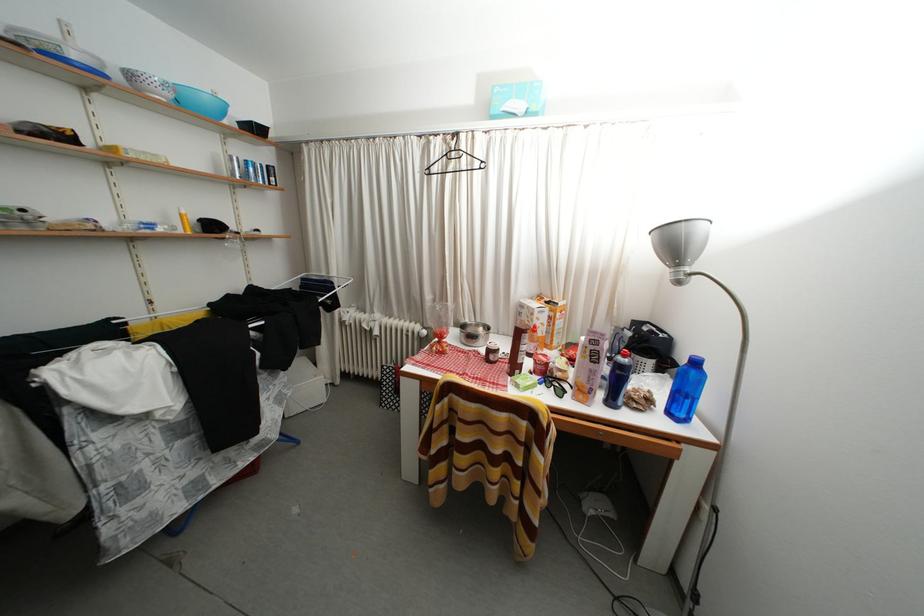
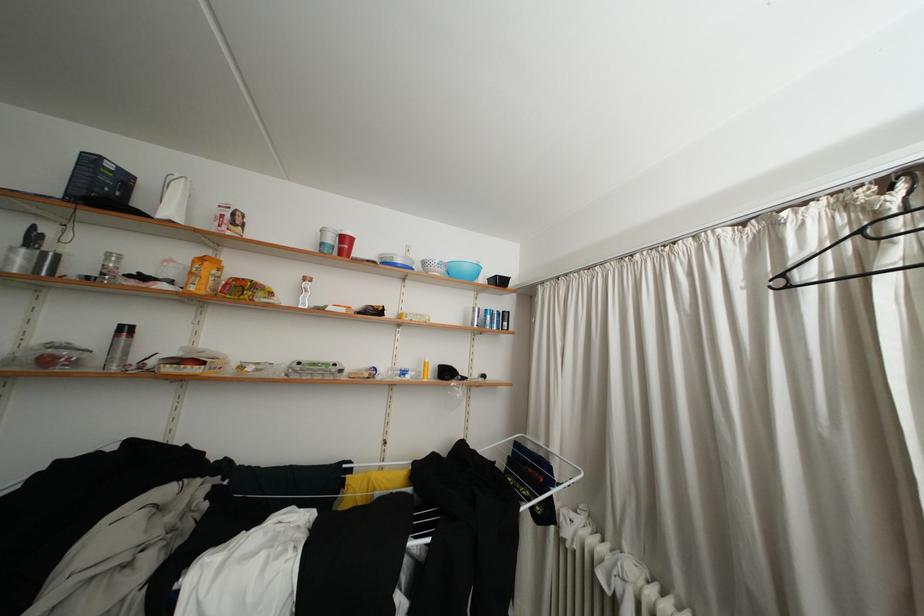
In the second image, find the point that corresponds to the point at 178,100 in the first image.

(451, 276)